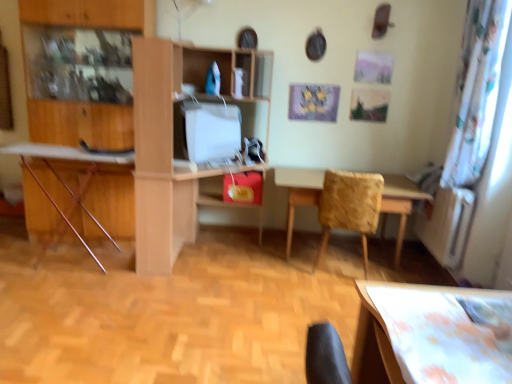
Find the location of `vacant space to the left of wooden chair at center`. vacant space to the left of wooden chair at center is located at coordinates (268, 264).